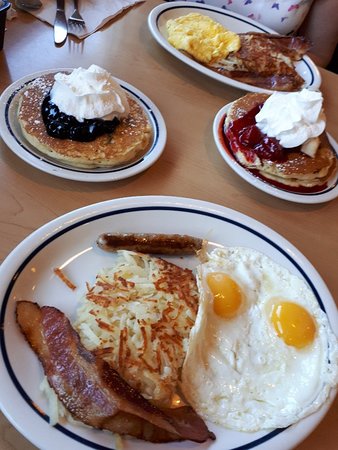
Identify the location of white plate. The width and height of the screenshot is (338, 450). (217, 447).